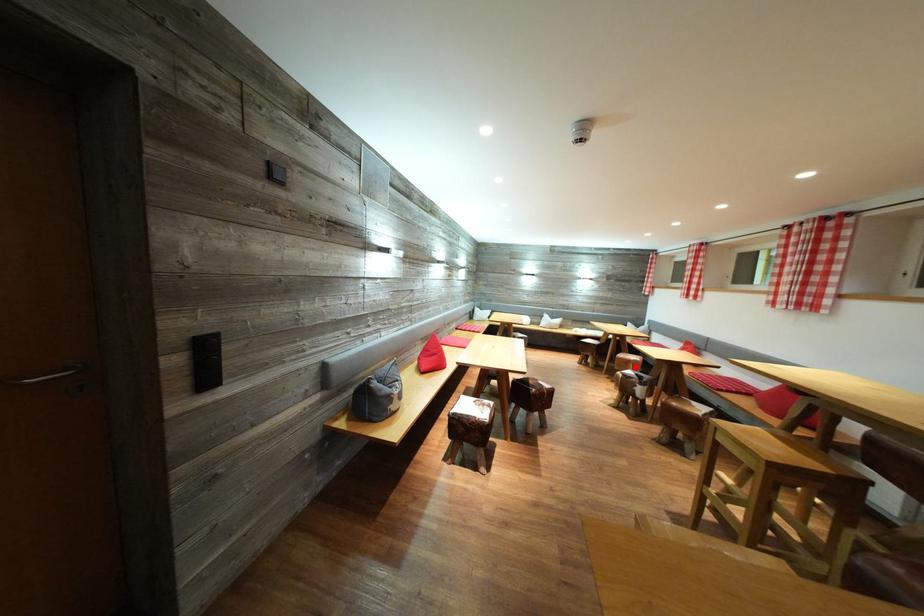
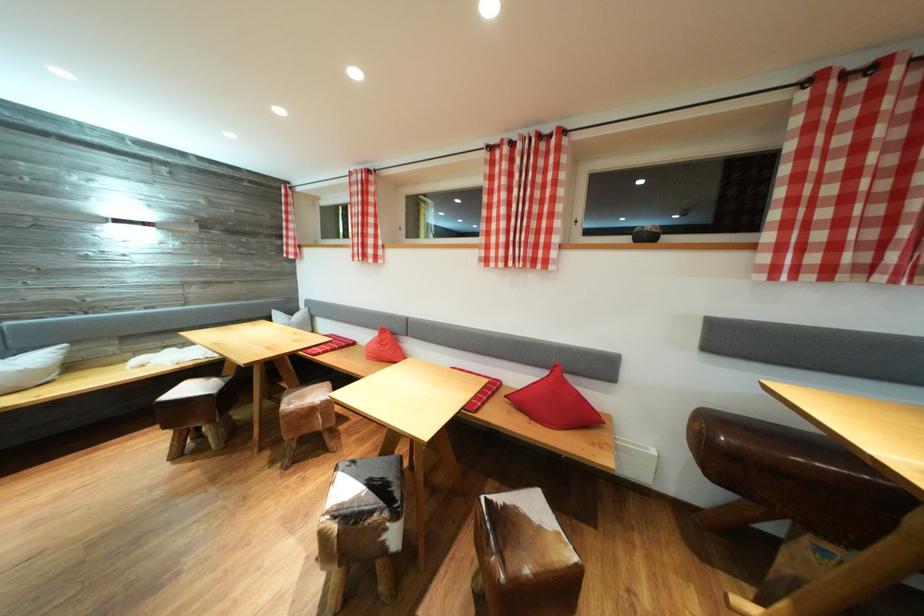
Question: I am providing you with two images of the same scene from different viewpoints. Image1 has a red point marked. In image2, the corresponding 3D location appears at what relative position? Reply with the corresponding letter.

Choices:
 (A) Closer
 (B) Farther

Answer: (B)